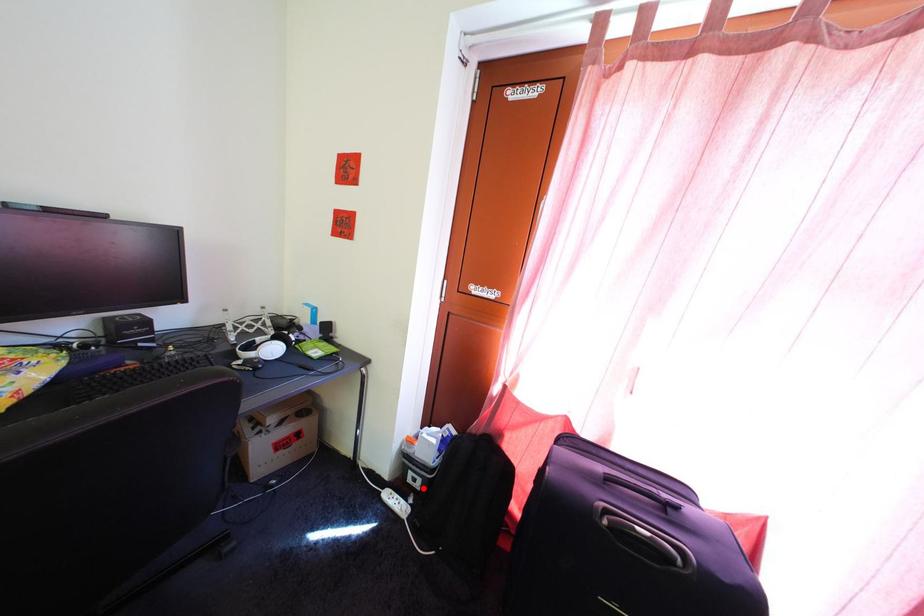
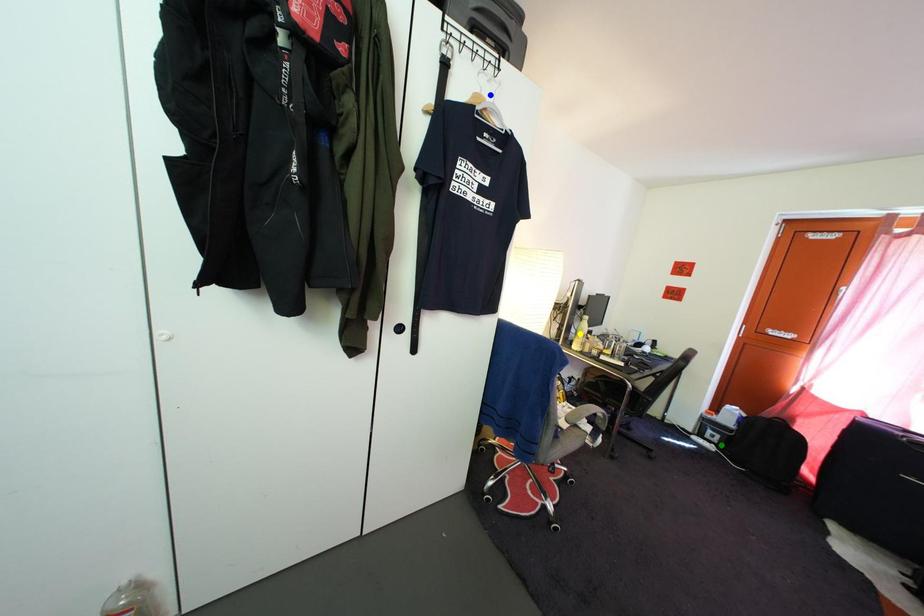
Question: I am providing you with two images of the same scene from different viewpoints. A red point is marked on the first image. You are given multiple points on the second image. Can you choose the point in image 2 that corresponds to the point in image 1?

Choices:
 (A) green point
 (B) blue point
 (C) yellow point

Answer: (A)